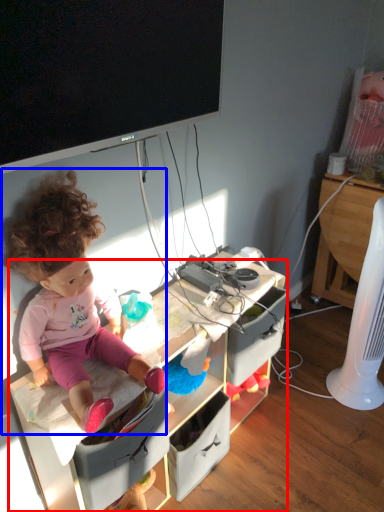
Question: Which point is closer to the camera, desk (highlighted by a red box) or person (highlighted by a blue box)?

Choices:
 (A) desk
 (B) person

Answer: (B)